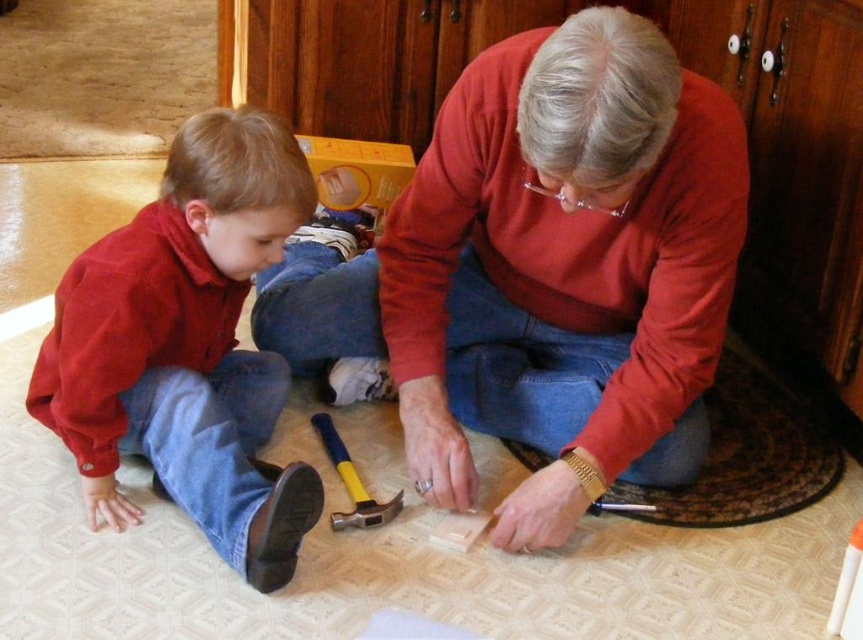
You are a robot observing the scene. You need to determine which object is taller between the matte wood block at center and the matte red shirt at lower left. Based on the scene description, which one is taller?

The matte wood block at center is taller than the matte red shirt at lower left.

Where is the matte red shirt at lower left located in the image?

The matte red shirt at lower left is located at point (187, 346) in the image.

You are a photographer standing in front of the scene. You need to capture a photo that includes both the matte red shirt at lower left and the yellow rubber hammer at center. Which object should you adjust your camera angle to ensure both are fully visible without cropping?

The matte red shirt at lower left is wider than the yellow rubber hammer at center, so you should adjust your camera angle to accommodate the wider matte red shirt at lower left to ensure both are fully visible without cropping.